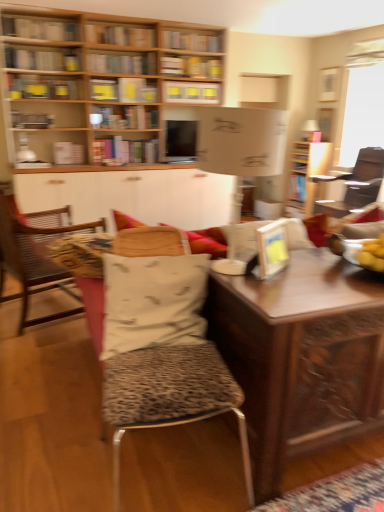
Identify the location of vacant area on top of metallic silver bookshelf at upper left, the eighth book viewed from the top (from a real-world perspective). The height and width of the screenshot is (512, 384). [x=39, y=108].